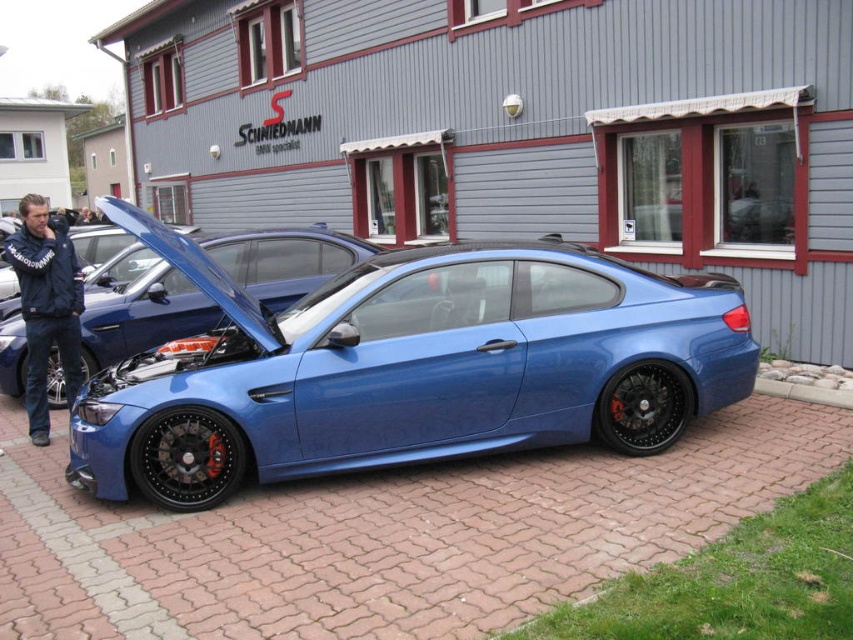
Can you confirm if satin blue car at center is bigger than blue fabric jacket at left?

Actually, satin blue car at center might be smaller than blue fabric jacket at left.

In the scene shown: Who is positioned more to the left, satin blue car at center or blue fabric jacket at left?

blue fabric jacket at left is more to the left.

Between point (271, 289) and point (39, 358), which one is positioned in front?

Point (39, 358) is in front.

What are the coordinates of `satin blue car at center` in the screenshot? It's located at (140, 308).

Looking at this image, between metallic blue sports car at center and blue fabric jacket at left, which one appears on the left side from the viewer's perspective?

blue fabric jacket at left

Who is more forward, (355,300) or (33,275)?

Point (355,300) is in front.

Is point (296, 440) less distant than point (39, 225)?

That is True.

This screenshot has height=640, width=853. Identify the location of metallic blue sports car at center. (421, 372).

Consider the image. Is metallic blue sports car at center to the left of satin blue car at center from the viewer's perspective?

No, metallic blue sports car at center is not to the left of satin blue car at center.

Does metallic blue sports car at center have a smaller size compared to satin blue car at center?

Incorrect, metallic blue sports car at center is not smaller in size than satin blue car at center.

Find the location of a particular element. metallic blue sports car at center is located at coordinates (421, 372).